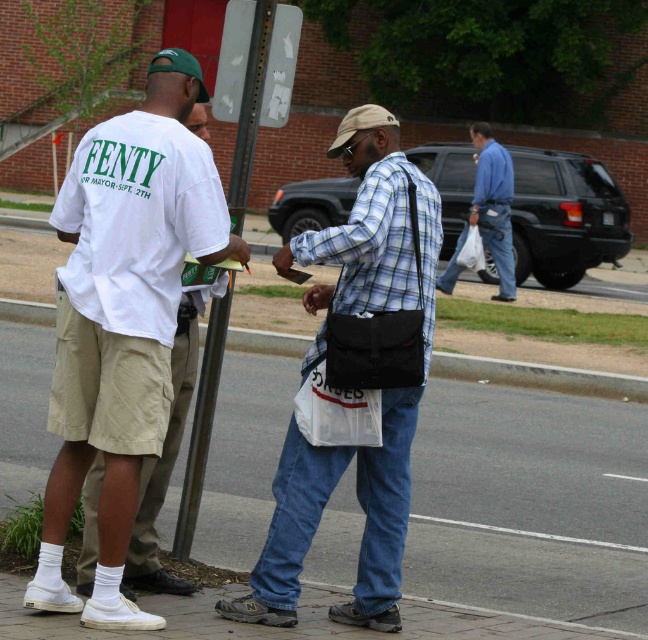
Consider the image. Measure the distance between smooth asphalt sidewalk at center and camera.

The distance of smooth asphalt sidewalk at center from camera is 37.12 feet.

You are a GUI agent. You are given a task and a screenshot of the screen. Output one action in this format:
    pyautogui.click(x=<x>, y=<y>)
    Task: Click on the smooth asphalt sidewalk at center
    The image size is (648, 640).
    Given the screenshot: What is the action you would take?
    pyautogui.click(x=529, y=502)

Is smooth asphalt sidewalk at center bigger than plaid cotton shirt at center?

No, smooth asphalt sidewalk at center is not bigger than plaid cotton shirt at center.

Is point (502, 548) positioned after point (397, 442)?

Yes, it is behind point (397, 442).

Is point (240, 358) more distant than point (360, 605)?

Yes, point (240, 358) is behind point (360, 605).

Identify the location of smooth asphalt sidewalk at center. (529, 502).

What do you see at coordinates (288, 531) in the screenshot? I see `plaid cotton shirt at center` at bounding box center [288, 531].

Does plaid cotton shirt at center have a lesser width compared to blue cotton shirt at center?

Yes.

What are the coordinates of `plaid cotton shirt at center` in the screenshot? It's located at (288, 531).